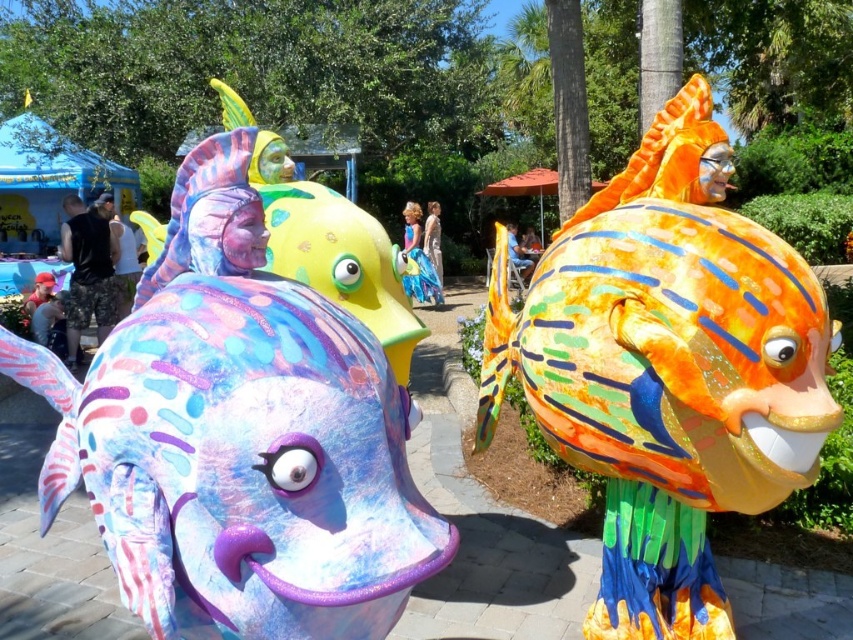
You are standing at the point marked as point (260, 416). You want to walk to the nearest fish sculpture. Which one should you walk towards?

The fish sculptures are 4.04 feet apart. Since you are at point (260, 416), you should walk towards the nearest fish sculpture based on their positions. However, without specific coordinates for the fish sculptures, it is impossible to determine which one is closer.

Based on the photo, you are at a park and see two fish sculptures, the pastel painted fish at center and the shiny orange fish at center. Which one is bigger?

The shiny orange fish at center is bigger than the pastel painted fish at center.

You are at a park event and see two fish sculptures, the pastel painted fish at center and the shiny orange fish at center. Which one is located to the left of the other?

The pastel painted fish at center is positioned on the left side of the shiny orange fish at center.